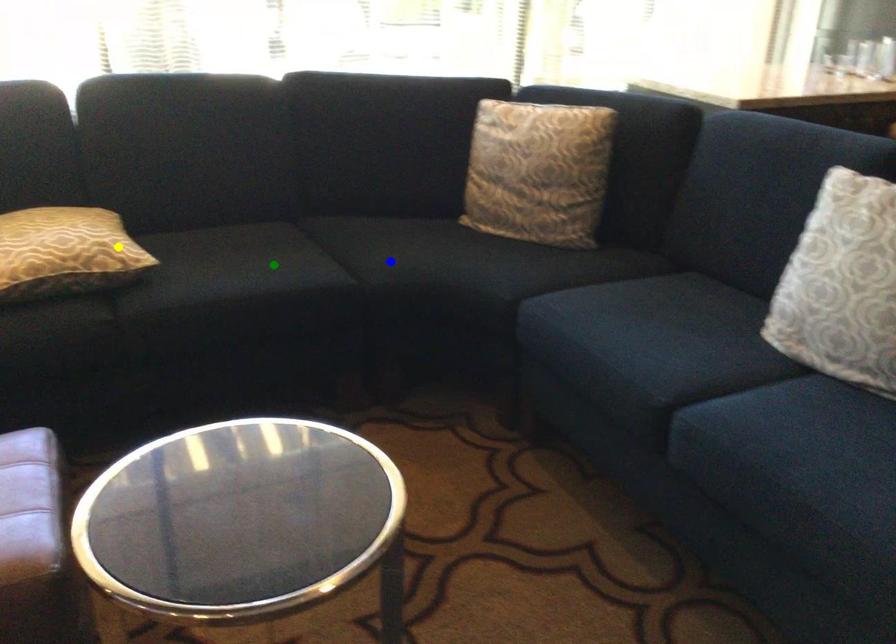
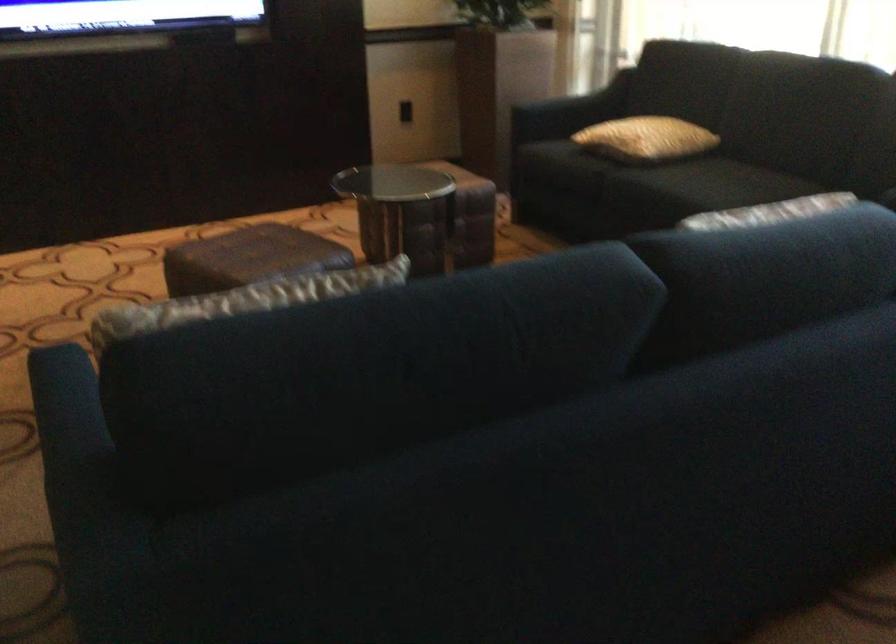
I am providing you with two images of the same scene from different viewpoints. Three points are marked in image1. Which point corresponds to a part or object that is occluded in image2?In image1, three points are marked. Which of them correspond to a part or object that is occluded in image2?Among the three points shown in image1, which one corresponds to a part or object that is no longer visible due to occlusion in image2?

blue point